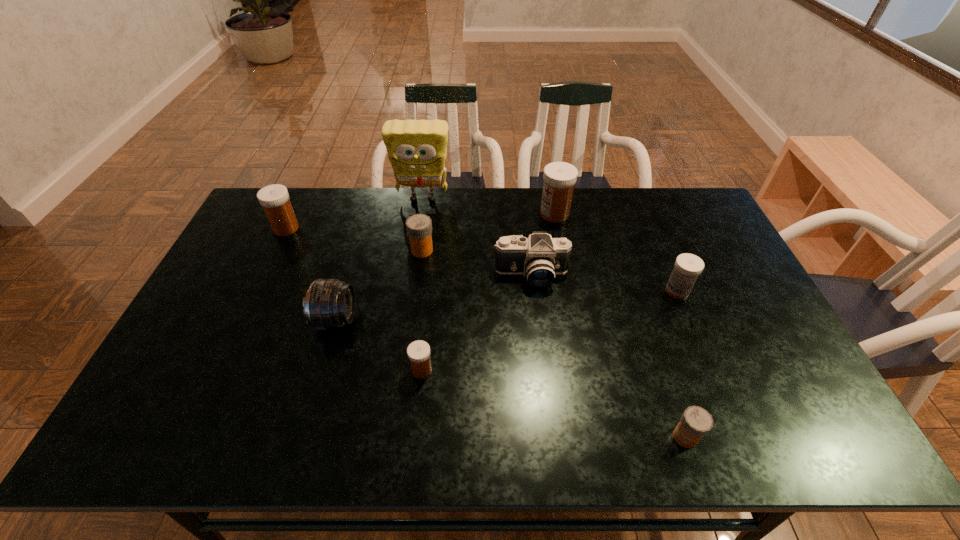
Where is `vacant space located 0.130m at the front element of the second object from left to right`? vacant space located 0.130m at the front element of the second object from left to right is located at coordinates (401, 320).

The image size is (960, 540). Find the location of `vacant space situated on the label side of the fourth nearest medicine`. vacant space situated on the label side of the fourth nearest medicine is located at coordinates (514, 251).

Find the location of a particular element. This screenshot has height=540, width=960. blank space located on the left of the fourth farthest medicine is located at coordinates (555, 291).

I want to click on free point located on the back of the nearest white medicine, so click(x=429, y=302).

In order to click on vacant space located on the label side of the eighth object from left to right in this screenshot , I will do `click(563, 437)`.

Locate an element on the screen. The width and height of the screenshot is (960, 540). blank space located 0.080m on the label side of the eighth object from left to right is located at coordinates (637, 437).

I want to click on vacant space situated 0.180m on the label side of the eighth object from left to right, so click(x=593, y=437).

Where is `sponge located at the far edge`? sponge located at the far edge is located at coordinates (417, 149).

Find the location of `object that is positioned at the near edge`. object that is positioned at the near edge is located at coordinates (696, 422).

Image resolution: width=960 pixels, height=540 pixels. What are the coordinates of `object that is at the left edge` in the screenshot? It's located at (274, 199).